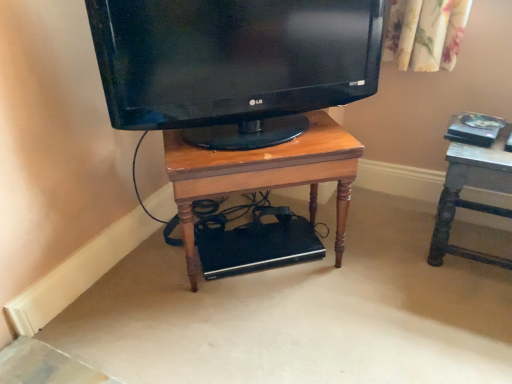
In order to click on vacant space underneath wooden table at right (from a real-world perspective) in this screenshot , I will do `click(476, 248)`.